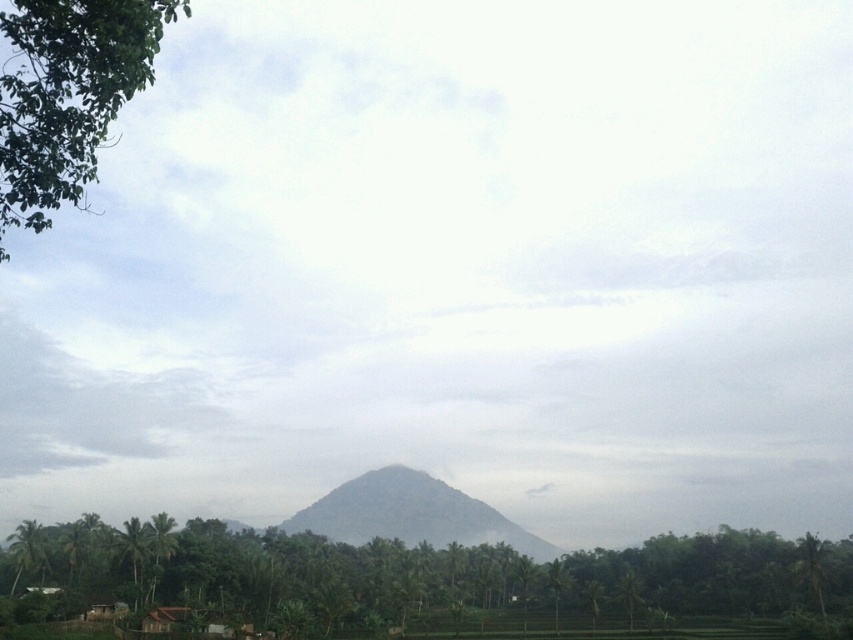
In the scene shown: Who is more distant from viewer, (596,570) or (18,3)?

The point (596,570) is behind.

Does green leafy trees at center have a lesser width compared to green leafy tree at upper left?

No.

Which is in front, point (169, 547) or point (112, 44)?

Point (112, 44) is in front.

The width and height of the screenshot is (853, 640). I want to click on green leafy trees at center, so click(431, 580).

Is green leafy tree at upper left above green textured mountain at center?

Yes.

Is green leafy tree at upper left bigger than green textured mountain at center?

Correct, green leafy tree at upper left is larger in size than green textured mountain at center.

Which is behind, point (157, 36) or point (445, 488)?

The point (445, 488) is behind.

Image resolution: width=853 pixels, height=640 pixels. Identify the location of green leafy tree at upper left. (67, 93).

Locate an element on the screen. The width and height of the screenshot is (853, 640). green leafy trees at center is located at coordinates (431, 580).

Is point (291, 561) more distant than point (375, 470)?

No, it is not.

The image size is (853, 640). In order to click on green leafy trees at center in this screenshot , I will do `click(431, 580)`.